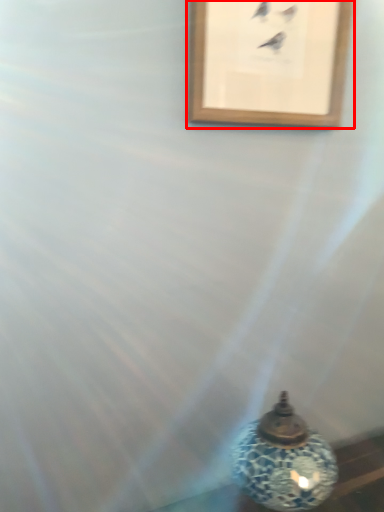
Question: From the image's perspective, where is picture frame (annotated by the red box) located in relation to oil lamp in the image?

Choices:
 (A) below
 (B) above

Answer: (B)